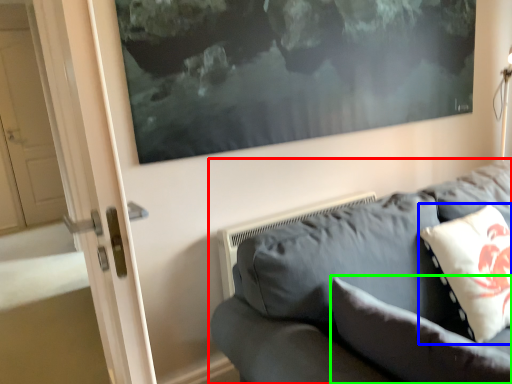
Question: Which object is the closest to the studio couch (highlighted by a red box)? Choose among these: pillow (highlighted by a blue box) or pillow (highlighted by a green box).

Choices:
 (A) pillow
 (B) pillow

Answer: (B)